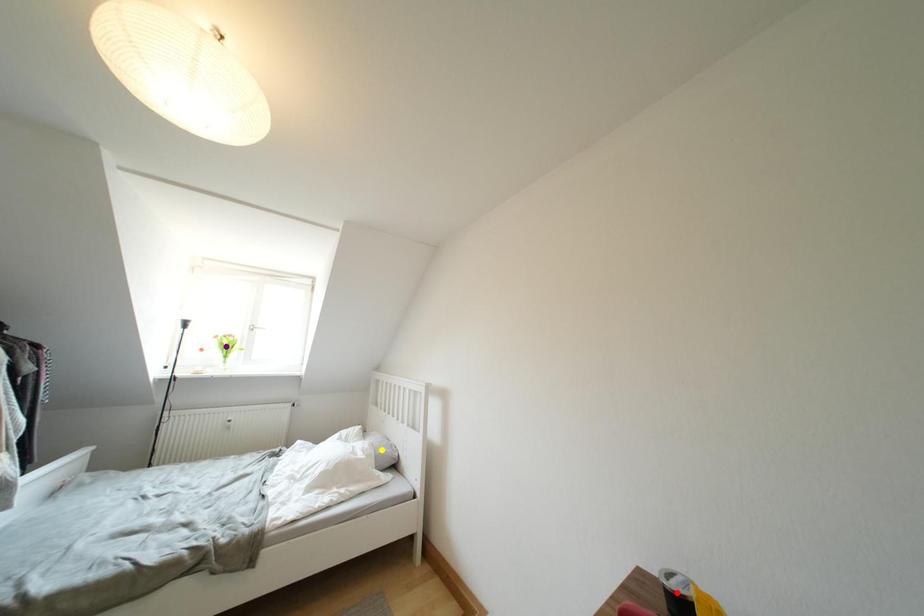
Order these from nearest to farthest:
purple point
red point
yellow point

purple point → yellow point → red point